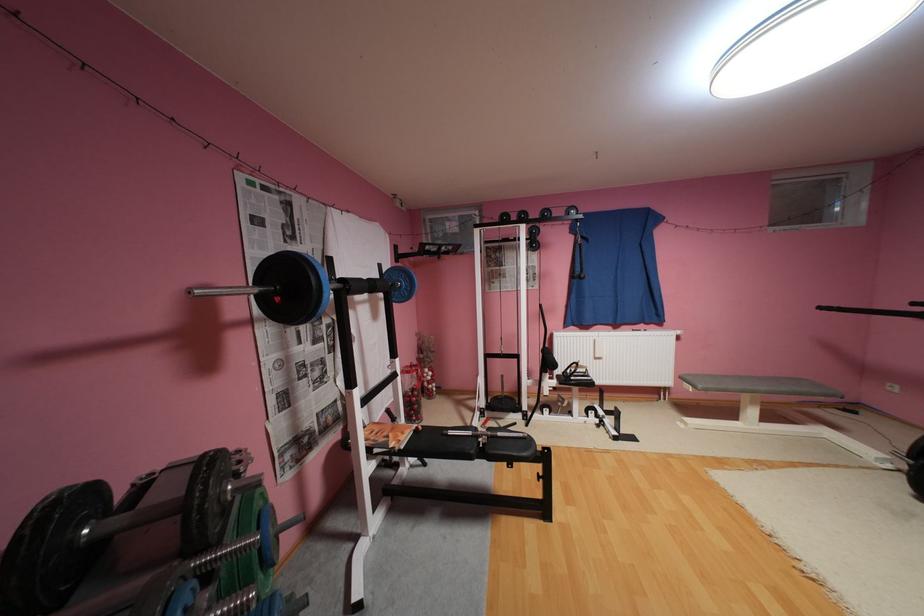
The location [52,549] corresponds to which object?

This point indicates the black weight plate.